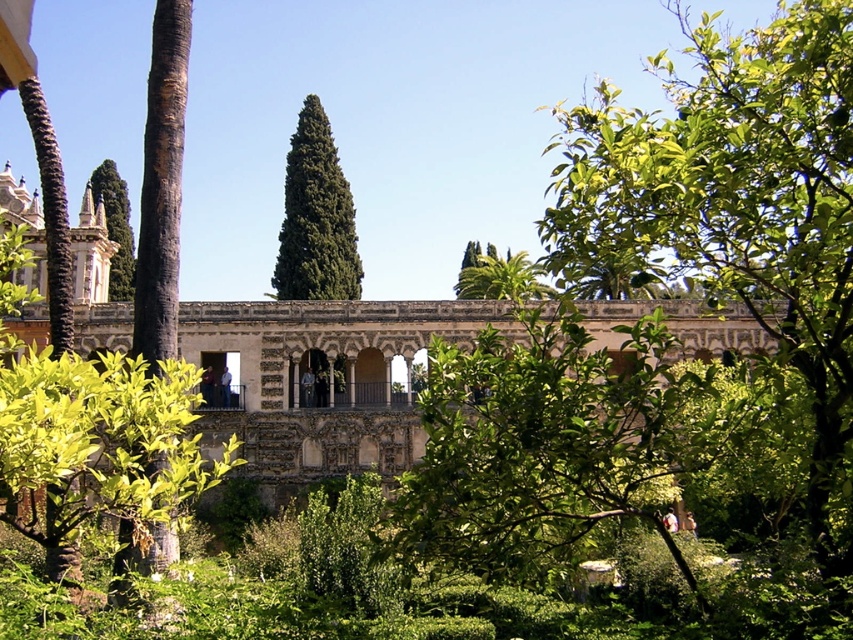
You are standing in the garden and want to walk towards the historic structure in the background. You notice two points marked in the scene. Which point, point [375,353] or point [125,244], is closer to you as you face the garden?

Point [375,353] is closer to the viewer than point [125,244].

You are planning to place a small bench between the green leafy tree at center and the green textured tree at center in the garden. Considering their widths, which tree will require more space on either side of the bench?

The green leafy tree at center has a larger width than the green textured tree at center, so it will require more space on either side of the bench.